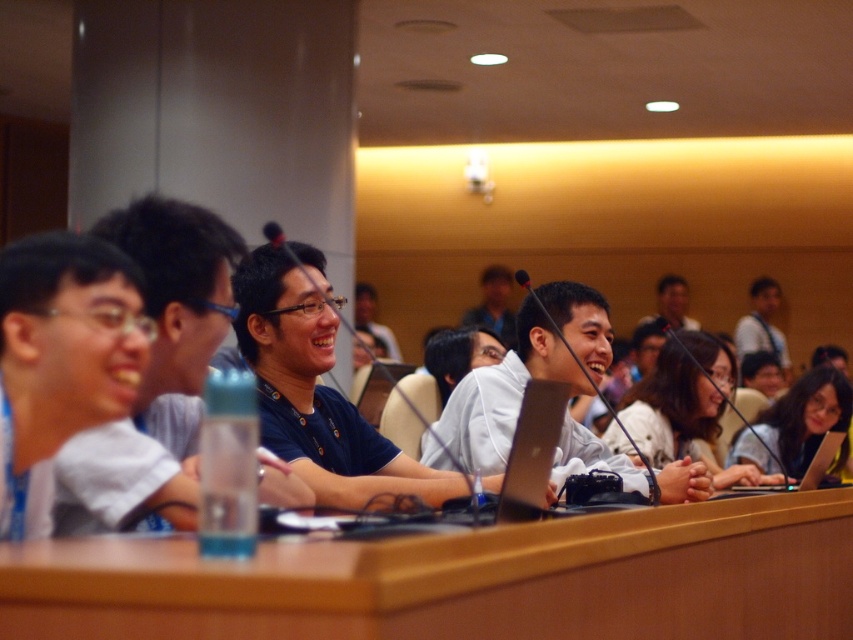
Between brown wood table at center and white matte shirt at center, which one has less height?

With less height is brown wood table at center.

Is brown wood table at center shorter than white matte shirt at center?

Yes.

The image size is (853, 640). I want to click on brown wood table at center, so click(463, 579).

From the picture: Does brown wood table at center appear over silver metallic laptop at lower right?

Incorrect, brown wood table at center is not positioned above silver metallic laptop at lower right.

Is brown wood table at center below silver metallic laptop at lower right?

Yes, brown wood table at center is below silver metallic laptop at lower right.

Is point (70, 566) farther from viewer compared to point (793, 484)?

No, (70, 566) is in front of (793, 484).

At what (x,y) coordinates should I click in order to perform the action: click on brown wood table at center. Please return your answer as a coordinate pair (x, y). Looking at the image, I should click on (463, 579).

Which of these two, white matte shirt at center or silver metallic laptop at lower right, stands shorter?

silver metallic laptop at lower right

Is white matte shirt at center to the right of silver metallic laptop at lower right from the viewer's perspective?

No, white matte shirt at center is not to the right of silver metallic laptop at lower right.

Does point (495, 426) lie behind point (809, 477)?

No, it is not.

This screenshot has width=853, height=640. In order to click on white matte shirt at center in this screenshot , I will do `click(505, 394)`.